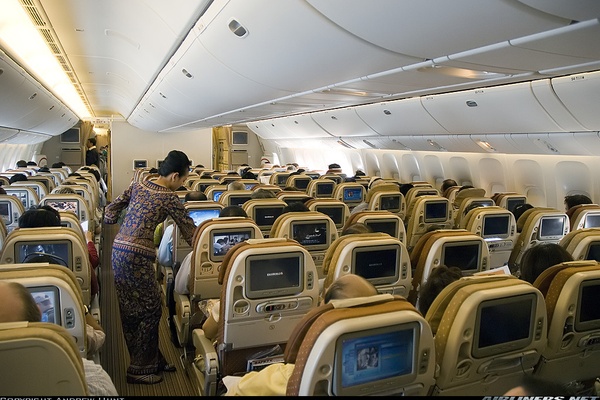
What are the coordinates of `handles` in the screenshot? It's located at (237, 30), (185, 74), (161, 96), (51, 110).